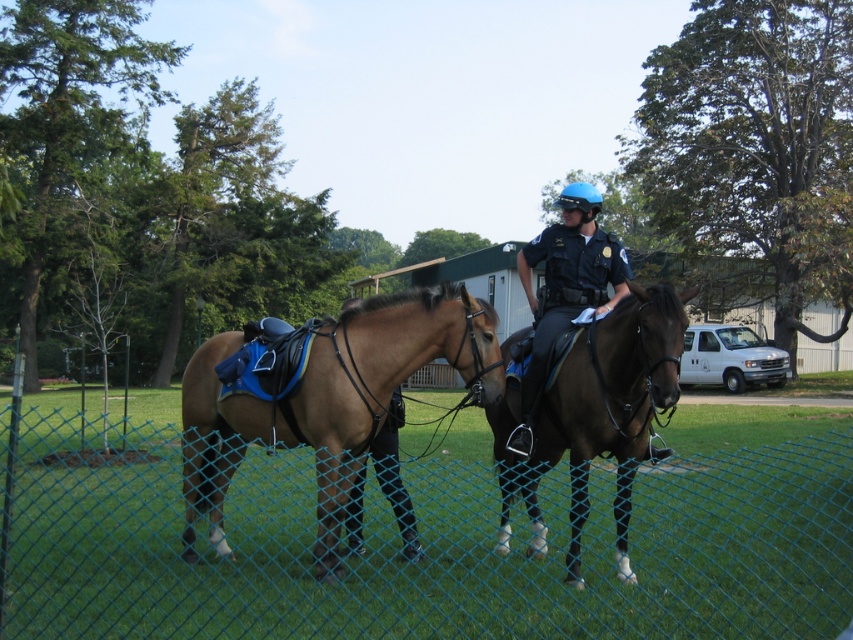
You are a photographer trying to capture a clear shot of the brown leather saddle at center and the dark blue uniform at center. Based on their positions, which one is closer to the camera?

The brown leather saddle at center is below the dark blue uniform at center, so the dark blue uniform at center is closer to the camera.

You are a police officer trying to determine if a new saddle will fit on your horse. The current saddle is the brown leather saddle at center, and the uniform you wear is the dark blue uniform at center. Based on the image, can you tell if the saddle is wider than your uniform?

The brown leather saddle at center has a larger width than the dark blue uniform at center, so yes, the saddle is wider than the uniform.

Looking at this image, you are a visitor in the park and want to take a photo of the two police officers on horses without the green chain link fence at lower center blocking the view. Where should you position yourself relative to the point marked by the coordinate point (444, 541)?

To avoid the green chain link fence at lower center blocking the view, you should position yourself either to the left or right of the coordinate point (444, 541), as the fence is located at that central point and extending outward from it.